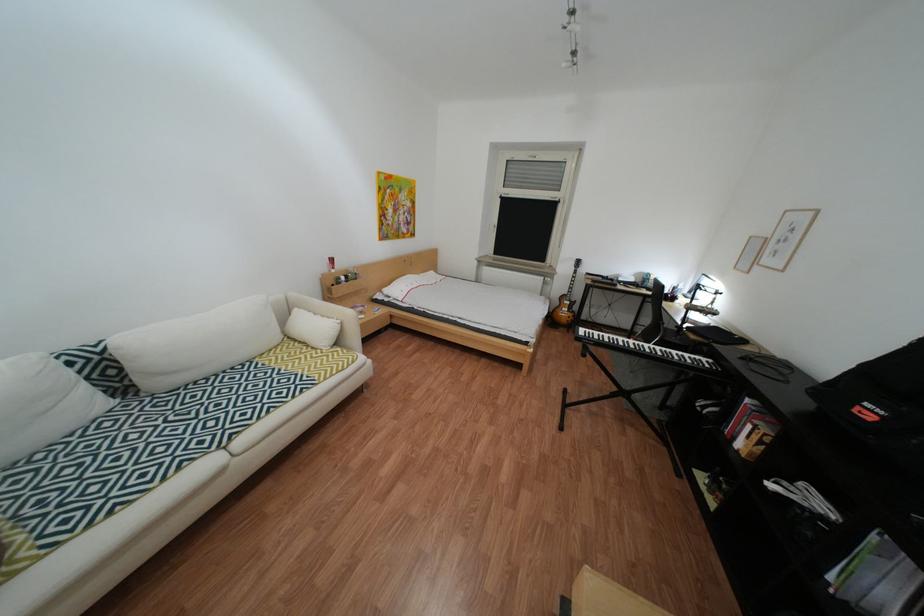
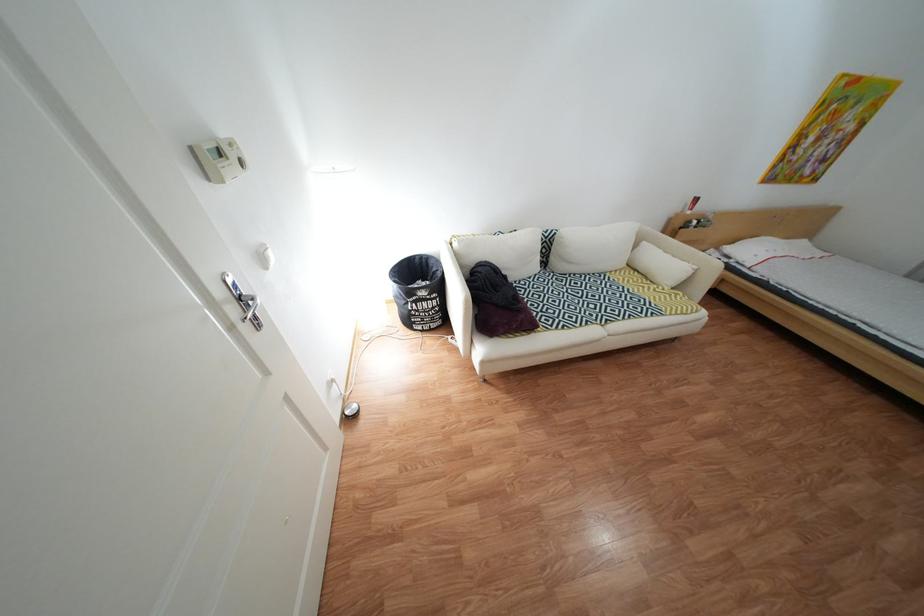
The point at (114, 351) is marked in the first image. Where is the corresponding point in the second image?

(562, 236)